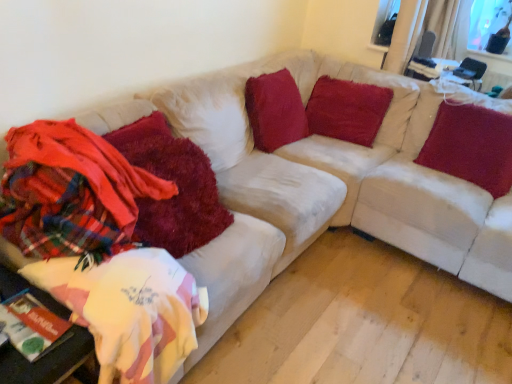
Image resolution: width=512 pixels, height=384 pixels. Describe the element at coordinates (471, 146) in the screenshot. I see `velvet red pillow at upper right, which is the first pillow from right to left` at that location.

What is the approximate width of plaid fabric blanket at left, acting as the first blanket starting from the left?

plaid fabric blanket at left, acting as the first blanket starting from the left, is 49.63 centimeters in width.

Where is `shaggy red blanket at left, the 2th blanket from the left`? The image size is (512, 384). shaggy red blanket at left, the 2th blanket from the left is located at coordinates (175, 183).

From the picture: Does plaid fabric blanket at left, acting as the first blanket starting from the left, have a lesser width compared to velvety red pillow at upper center, the second pillow in the right-to-left sequence?

Incorrect, the width of plaid fabric blanket at left, acting as the first blanket starting from the left, is not less than that of velvety red pillow at upper center, the second pillow in the right-to-left sequence.

Considering the relative positions of plaid fabric blanket at left, which is counted as the second blanket, starting from the right, and velvety red pillow at upper center, the second pillow viewed from the left, in the image provided, is plaid fabric blanket at left, which is counted as the second blanket, starting from the right, to the left or to the right of velvety red pillow at upper center, the second pillow viewed from the left,?

plaid fabric blanket at left, which is counted as the second blanket, starting from the right, is to the left of velvety red pillow at upper center, the second pillow viewed from the left.

Who is taller, plaid fabric blanket at left, which is counted as the second blanket, starting from the right, or velvety red pillow at upper center, the second pillow in the right-to-left sequence?

velvety red pillow at upper center, the second pillow in the right-to-left sequence, is taller.

Is plaid fabric blanket at left, which is counted as the second blanket, starting from the right, directly adjacent to velvety red pillow at upper center, the second pillow in the right-to-left sequence?

No, plaid fabric blanket at left, which is counted as the second blanket, starting from the right, is not making contact with velvety red pillow at upper center, the second pillow in the right-to-left sequence.

Can you confirm if transparent glass window at upper right, the second window screen positioned from the left, is thinner than velvet red pillow at upper right, which is the first pillow from right to left?

Correct, the width of transparent glass window at upper right, the second window screen positioned from the left, is less than that of velvet red pillow at upper right, which is the first pillow from right to left.

Which object is further away from the camera taking this photo, transparent glass window at upper right, the second window screen positioned from the left, or velvet red pillow at upper right, which is counted as the third pillow, starting from the left?

Positioned behind is transparent glass window at upper right, the second window screen positioned from the left.

Is transparent glass window at upper right, the first window screen viewed from the right, inside the boundaries of velvet red pillow at upper right, which is counted as the third pillow, starting from the left, or outside?

transparent glass window at upper right, the first window screen viewed from the right, is not enclosed by velvet red pillow at upper right, which is counted as the third pillow, starting from the left.

There is a shaggy red blanket at left, the 2th blanket from the left. Where is `the 2nd window screen above it (from the image's perspective)`? the 2nd window screen above it (from the image's perspective) is located at coordinates (487, 21).

In the scene shown: Considering the relative positions of shaggy red blanket at left, positioned as the 1th blanket in right-to-left order, and transparent glass window at upper right, the first window screen viewed from the right, in the image provided, is shaggy red blanket at left, positioned as the 1th blanket in right-to-left order, to the left of transparent glass window at upper right, the first window screen viewed from the right, from the viewer's perspective?

Indeed, shaggy red blanket at left, positioned as the 1th blanket in right-to-left order, is positioned on the left side of transparent glass window at upper right, the first window screen viewed from the right.

From the image's perspective, would you say shaggy red blanket at left, the 2th blanket from the left, is shown under transparent glass window at upper right, the first window screen viewed from the right?

Correct, shaggy red blanket at left, the 2th blanket from the left, appears lower than transparent glass window at upper right, the first window screen viewed from the right, in the image.

Considering the relative sizes of shaggy red blanket at left, positioned as the 1th blanket in right-to-left order, and transparent glass window at upper right, the first window screen viewed from the right, in the image provided, is shaggy red blanket at left, positioned as the 1th blanket in right-to-left order, thinner than transparent glass window at upper right, the first window screen viewed from the right,?

No, shaggy red blanket at left, positioned as the 1th blanket in right-to-left order, is not thinner than transparent glass window at upper right, the first window screen viewed from the right.

Is transparent glass window screen at upper right, placed as the 1th window screen when sorted from left to right, aimed at white fabric table at lower left?

Yes, transparent glass window screen at upper right, placed as the 1th window screen when sorted from left to right, is turned towards white fabric table at lower left.

Between point (379, 8) and point (55, 309), which one is positioned in front?

The point (55, 309) is in front.

Which object is positioned more to the right, transparent glass window screen at upper right, placed as the 1th window screen when sorted from left to right, or white fabric table at lower left?

From the viewer's perspective, transparent glass window screen at upper right, placed as the 1th window screen when sorted from left to right, appears more on the right side.

Does transparent glass window screen at upper right, placed as the 1th window screen when sorted from left to right, come in front of white fabric table at lower left?

No, transparent glass window screen at upper right, placed as the 1th window screen when sorted from left to right, is behind white fabric table at lower left.

Based on the photo, considering the positions of objects velvety red pillow at upper center, the second pillow viewed from the left, and plaid fabric blanket at left, which is counted as the second blanket, starting from the right, in the image provided, who is behind, velvety red pillow at upper center, the second pillow viewed from the left, or plaid fabric blanket at left, which is counted as the second blanket, starting from the right,?

velvety red pillow at upper center, the second pillow viewed from the left, is more distant.

Is plaid fabric blanket at left, acting as the first blanket starting from the left, completely or partially inside velvety red pillow at upper center, the second pillow viewed from the left?

Actually, plaid fabric blanket at left, acting as the first blanket starting from the left, is outside velvety red pillow at upper center, the second pillow viewed from the left.

What are the coordinates of `the 1st blanket positioned below the velvety red pillow at upper center, the second pillow viewed from the left (from the image's perspective)` in the screenshot? It's located at (71, 192).

How many degrees apart are the facing directions of velvety red pillow at upper center, the second pillow viewed from the left, and plaid fabric blanket at left, which is counted as the second blanket, starting from the right?

They differ by 88.6 degrees in their facing directions.

From a real-world perspective, is velvet red pillow at upper right, which is counted as the third pillow, starting from the left, located higher than velvety red pillow at upper center, the second pillow viewed from the left?

Correct, in the physical world, velvet red pillow at upper right, which is counted as the third pillow, starting from the left, is higher than velvety red pillow at upper center, the second pillow viewed from the left.

Considering the relative sizes of velvet red pillow at upper right, which is counted as the third pillow, starting from the left, and velvety red pillow at upper center, the second pillow viewed from the left, in the image provided, is velvet red pillow at upper right, which is counted as the third pillow, starting from the left, shorter than velvety red pillow at upper center, the second pillow viewed from the left,?

Correct, velvet red pillow at upper right, which is counted as the third pillow, starting from the left, is not as tall as velvety red pillow at upper center, the second pillow viewed from the left.

Does point (442, 109) come in front of point (327, 125)?

Yes, point (442, 109) is in front of point (327, 125).

Is velvet red pillow at upper right, which is the first pillow from right to left, outside of velvety red pillow at upper center, the second pillow in the right-to-left sequence?

velvet red pillow at upper right, which is the first pillow from right to left, lies outside velvety red pillow at upper center, the second pillow in the right-to-left sequence,'s area.

Is velvet red pillow at upper right, which is counted as the third pillow, starting from the left, placed right next to transparent glass window screen at upper right, placed as the 1th window screen when sorted from left to right?

No, velvet red pillow at upper right, which is counted as the third pillow, starting from the left, is not with transparent glass window screen at upper right, placed as the 1th window screen when sorted from left to right.

From the image's perspective, is velvet red pillow at upper right, which is counted as the third pillow, starting from the left, on top of transparent glass window screen at upper right, placed as the 1th window screen when sorted from left to right?

No, from the image's perspective, velvet red pillow at upper right, which is counted as the third pillow, starting from the left, is not over transparent glass window screen at upper right, placed as the 1th window screen when sorted from left to right.

Is velvet red pillow at upper right, which is the first pillow from right to left, outside of transparent glass window screen at upper right, which appears as the 2th window screen when viewed from the right?

Indeed, velvet red pillow at upper right, which is the first pillow from right to left, is completely outside transparent glass window screen at upper right, which appears as the 2th window screen when viewed from the right.

Which blanket is the 2nd one when counting from the front of the velvety red pillow at upper center, the second pillow viewed from the left? Please provide its 2D coordinates.

[(71, 192)]

Image resolution: width=512 pixels, height=384 pixels. Identify the location of pillow that is the 3rd object located below the transparent glass window at upper right, the first window screen viewed from the right (from the image's perspective). (471, 146).

Which object lies further to the anchor point plaid fabric blanket at left, which is counted as the second blanket, starting from the right, transparent glass window at upper right, the second window screen positioned from the left, or velvety red pillow at upper center, the third pillow positioned from the right?

transparent glass window at upper right, the second window screen positioned from the left.

Which object lies further to the anchor point shaggy red blanket at left, positioned as the 1th blanket in right-to-left order, white fabric table at lower left or velvety red pillow at upper center, the second pillow viewed from the left?

velvety red pillow at upper center, the second pillow viewed from the left, is positioned further to the anchor shaggy red blanket at left, positioned as the 1th blanket in right-to-left order.

From the image, which object appears to be farther from velvety red pillow at upper center, arranged as the first pillow when viewed from the left, transparent glass window screen at upper right, which appears as the 2th window screen when viewed from the right, or velvety red pillow at upper center, the second pillow viewed from the left?

transparent glass window screen at upper right, which appears as the 2th window screen when viewed from the right, is positioned further to the anchor velvety red pillow at upper center, arranged as the first pillow when viewed from the left.

From the image, which object appears to be farther from plaid fabric blanket at left, acting as the first blanket starting from the left, velvet red pillow at upper right, which is the first pillow from right to left, or velvety red pillow at upper center, the second pillow viewed from the left?

velvet red pillow at upper right, which is the first pillow from right to left, is further to plaid fabric blanket at left, acting as the first blanket starting from the left.

Based on their spatial positions, is shaggy red blanket at left, the 2th blanket from the left, or transparent glass window at upper right, the second window screen positioned from the left, closer to plaid fabric blanket at left, which is counted as the second blanket, starting from the right?

shaggy red blanket at left, the 2th blanket from the left.

Estimate the real-world distances between objects in this image. Which object is further from velvet red pillow at upper right, which is the first pillow from right to left, velvety red pillow at upper center, the second pillow in the right-to-left sequence, or plaid fabric blanket at left, acting as the first blanket starting from the left?

plaid fabric blanket at left, acting as the first blanket starting from the left.

Estimate the real-world distances between objects in this image. Which object is further from plaid fabric blanket at left, which is counted as the second blanket, starting from the right, velvety red pillow at upper center, the second pillow in the right-to-left sequence, or velvet red pillow at upper right, which is the first pillow from right to left?

velvet red pillow at upper right, which is the first pillow from right to left, lies further to plaid fabric blanket at left, which is counted as the second blanket, starting from the right, than the other object.

When comparing their distances from transparent glass window at upper right, the second window screen positioned from the left, does velvety red pillow at upper center, arranged as the first pillow when viewed from the left, or white fabric table at lower left seem further?

Based on the image, white fabric table at lower left appears to be further to transparent glass window at upper right, the second window screen positioned from the left.

Image resolution: width=512 pixels, height=384 pixels. I want to click on blanket between plaid fabric blanket at left, which is counted as the second blanket, starting from the right, and white fabric table at lower left from top to bottom, so click(x=175, y=183).

Identify the location of pillow between velvety red pillow at upper center, the second pillow viewed from the left, and transparent glass window at upper right, the second window screen positioned from the left, in the horizontal direction. This screenshot has width=512, height=384. (471, 146).

At what (x,y) coordinates should I click in order to perform the action: click on window screen situated between velvety red pillow at upper center, the third pillow positioned from the right, and velvet red pillow at upper right, which is counted as the third pillow, starting from the left, from left to right. Please return your answer as a coordinate pair (x, y). Image resolution: width=512 pixels, height=384 pixels. Looking at the image, I should click on (385, 22).

You are a GUI agent. You are given a task and a screenshot of the screen. Output one action in this format:
    pyautogui.click(x=<x>, y=<y>)
    Task: Click on the window screen situated between white fabric table at lower left and transparent glass window at upper right, the first window screen viewed from the right, from left to right
    The height and width of the screenshot is (384, 512).
    Given the screenshot: What is the action you would take?
    pyautogui.click(x=385, y=22)